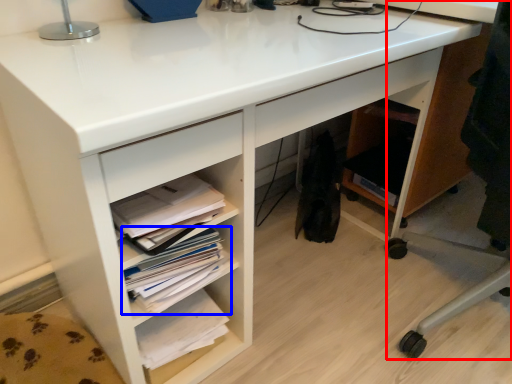
Question: Among these objects, which one is farthest to the camera, computer chair (highlighted by a red box) or book (highlighted by a blue box)?

Choices:
 (A) computer chair
 (B) book

Answer: (B)